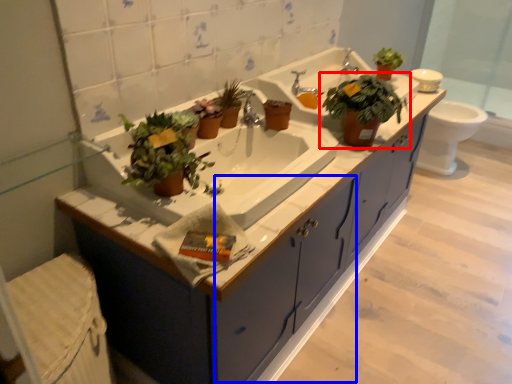
Question: Among these objects, which one is nearest to the camera, houseplant (highlighted by a red box) or drawer (highlighted by a blue box)?

Choices:
 (A) houseplant
 (B) drawer

Answer: (A)